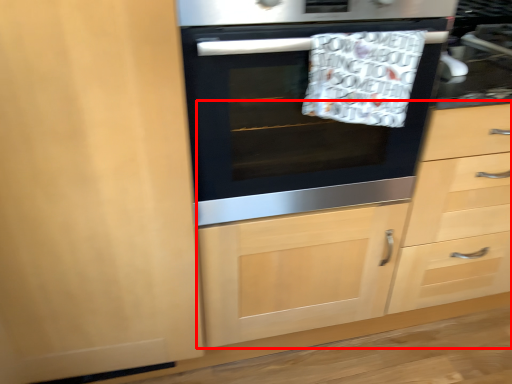
Question: From the image's perspective, where is dresser (annotated by the red box) located relative to oven?

Choices:
 (A) above
 (B) below

Answer: (B)